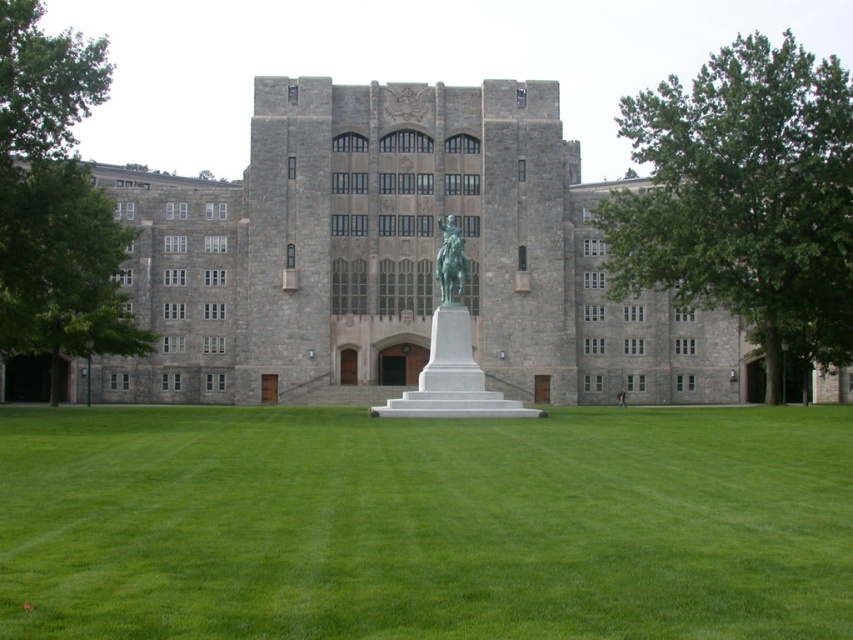
Does green grass at center appear on the left side of green leafy tree at left?

No, green grass at center is not to the left of green leafy tree at left.

Can you confirm if green grass at center is positioned above green leafy tree at left?

Incorrect, green grass at center is not positioned above green leafy tree at left.

Does point (747, 545) come behind point (10, 120)?

No, it is in front of (10, 120).

Identify the location of green grass at center. (424, 524).

Who is more forward, (84, 445) or (451, 220)?

Point (84, 445) is more forward.

What do you see at coordinates (424, 524) in the screenshot?
I see `green grass at center` at bounding box center [424, 524].

Which is in front, point (33, 444) or point (450, 298)?

Point (33, 444) is more forward.

Locate an element on the screen. This screenshot has width=853, height=640. green grass at center is located at coordinates (424, 524).

Between green leafy tree at left and white marble statue at center, which one has less height?

Standing shorter between the two is white marble statue at center.

Which is in front, point (65, 74) or point (436, 276)?

Point (65, 74) is more forward.

The image size is (853, 640). What do you see at coordinates (55, 202) in the screenshot? I see `green leafy tree at left` at bounding box center [55, 202].

Where is `green leafy tree at left`? The image size is (853, 640). green leafy tree at left is located at coordinates (55, 202).